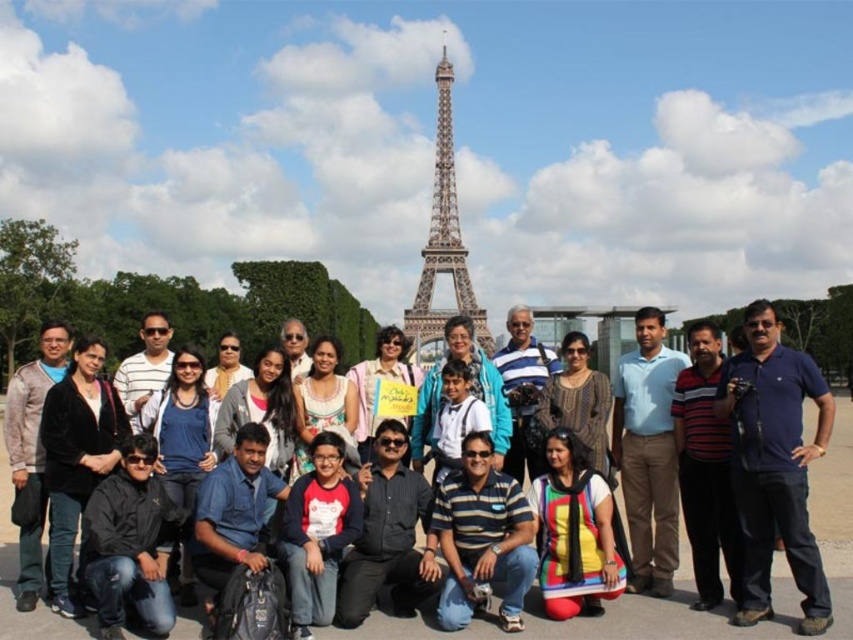
The height and width of the screenshot is (640, 853). What do you see at coordinates (705, 468) in the screenshot?
I see `striped cotton shirt at center` at bounding box center [705, 468].

How far apart are striped cotton shirt at center and painted steel eiffel tower at center?

striped cotton shirt at center and painted steel eiffel tower at center are 65.75 meters apart from each other.

Is point (700, 564) farther from camera compared to point (416, 305)?

That is True.

At what (x,y) coordinates should I click in order to perform the action: click on striped cotton shirt at center. Please return your answer as a coordinate pair (x, y). This screenshot has width=853, height=640. Looking at the image, I should click on (705, 468).

Is point (332, 531) more distant than point (473, 404)?

That is False.

Which is more to the right, red cotton shirt at center or blue shirt at center?

blue shirt at center

The image size is (853, 640). Identify the location of red cotton shirt at center. (317, 532).

In the scene shown: Can you confirm if black jacket at lower left is wider than blue shirt at center?

Yes.

This screenshot has height=640, width=853. Describe the element at coordinates (128, 544) in the screenshot. I see `black jacket at lower left` at that location.

Who is more forward, (x=163, y=612) or (x=466, y=428)?

Point (x=163, y=612)

At what (x,y) coordinates should I click in order to perform the action: click on black jacket at lower left. Please return your answer as a coordinate pair (x, y). Looking at the image, I should click on (128, 544).